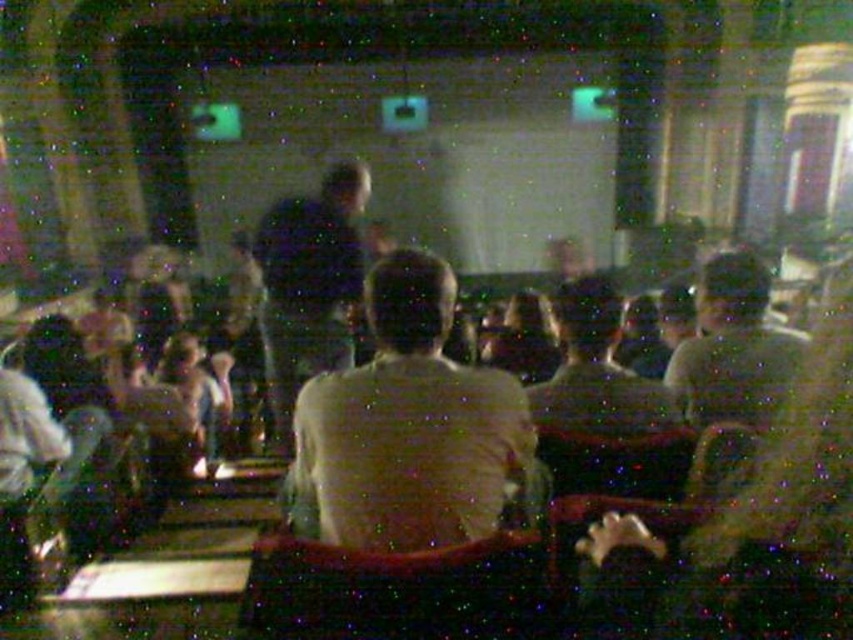
Question: Which point appears closest to the camera in this image?

Choices:
 (A) click(x=431, y=420)
 (B) click(x=779, y=400)

Answer: (A)

Question: Can you confirm if light brown shirt at center is wider than light brown leather jacket at center?

Choices:
 (A) no
 (B) yes

Answer: (B)

Question: Can you confirm if light brown shirt at center is thinner than light brown leather jacket at center?

Choices:
 (A) yes
 (B) no

Answer: (B)

Question: Which of the following is the farthest from the observer?

Choices:
 (A) light brown shirt at center
 (B) dark blue shirt at center

Answer: (B)

Question: Is dark blue shirt at center wider than light brown leather jacket at center?

Choices:
 (A) yes
 (B) no

Answer: (B)

Question: Among these points, which one is nearest to the camera?

Choices:
 (A) (387, 545)
 (B) (286, 385)
 (C) (718, 387)

Answer: (A)